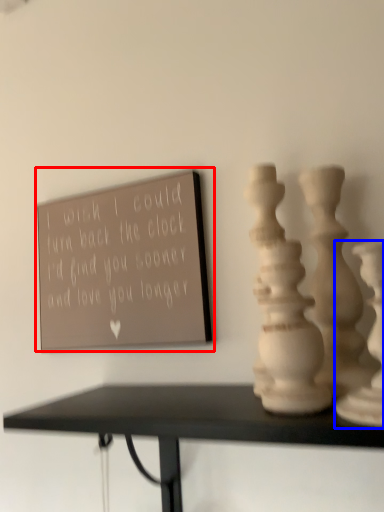
Question: Which object appears closest to the camera in this image, bulletin board (highlighted by a red box) or vase (highlighted by a blue box)?

Choices:
 (A) bulletin board
 (B) vase

Answer: (B)